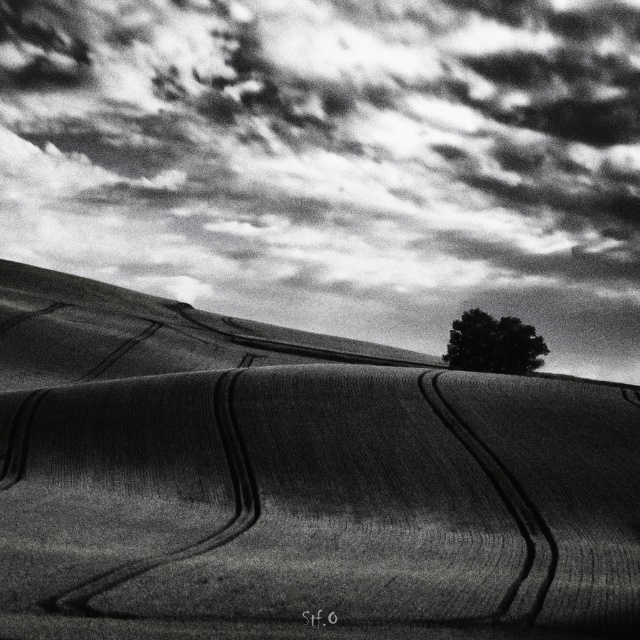
You are a photographer planning to capture the cloudy sky at upper center and the dark green textured tree at center in a single frame. Based on the scene, which object occupies a larger portion of the image?

The cloudy sky at upper center might be wider than dark green textured tree at center according to the description.

You are a photographer analyzing the composition of this black and white photo. The scene includes a cloudy sky at upper center and a solitary tree in the midground on the right. Based on their positions, which object is closer to the center of the image?

The cloudy sky at upper center is located at point (337,161), which is closer to the center of the image compared to the solitary tree in the midground on the right.